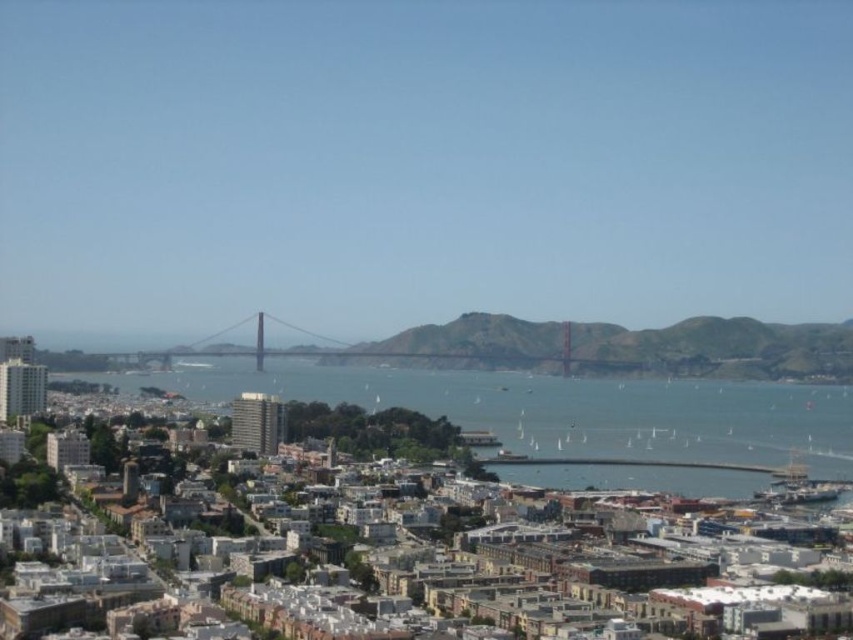
You are a tourist in the coastal city and want to take a photo of the metallic bridge at center without any obstructions. Since you are standing on the blue water at center, can you take the photo clearly?

The blue water at center is positioned under the metallic bridge at center, so if you are standing on the blue water at center, you can take a photo of the metallic bridge at center without any obstructions as the water is directly beneath the bridge.

You are standing at the point with coordinates 0.5, 0.5 in the image. Which direction should you move to reach the blue water at center?

The blue water at center is located at coordinates (558, 408). Since your current position is at (426, 320), you should move northeast to reach it.

You are a tourist standing at the observation deck of the tallest building in the city. You see the point labeled as point (558, 408). What is the color of the object at that point?

The point (558, 408) indicates blue water at center.